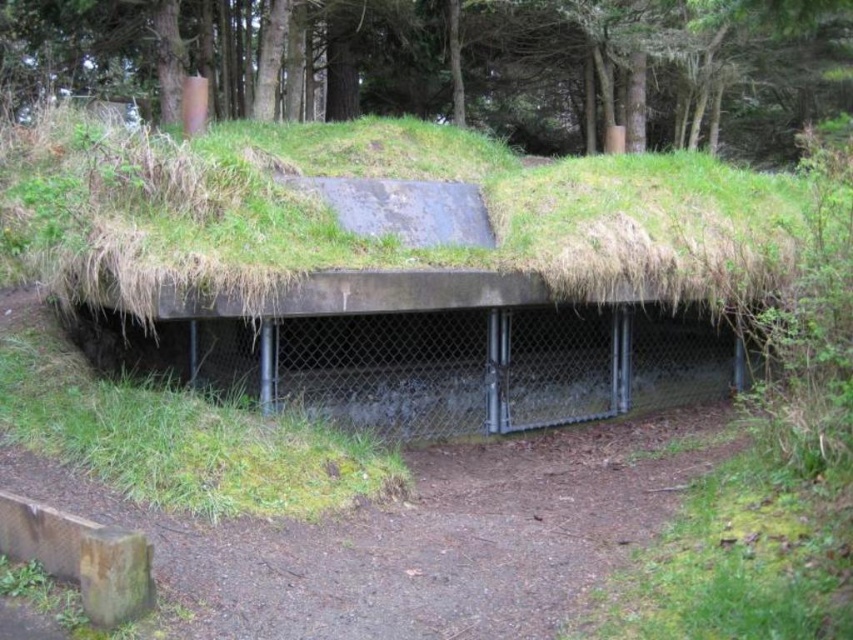
Does point (535, 400) come closer to viewer compared to point (260, 74)?

That is True.

Between green moss-covered shelter at center and green grassy mound at upper center, which one appears on the left side from the viewer's perspective?

green moss-covered shelter at center

Is point (566, 230) less distant than point (347, 58)?

Yes, it is.

You are a GUI agent. You are given a task and a screenshot of the screen. Output one action in this format:
    pyautogui.click(x=<x>, y=<y>)
    Task: Click on the green moss-covered shelter at center
    
    Given the screenshot: What is the action you would take?
    pyautogui.click(x=439, y=244)